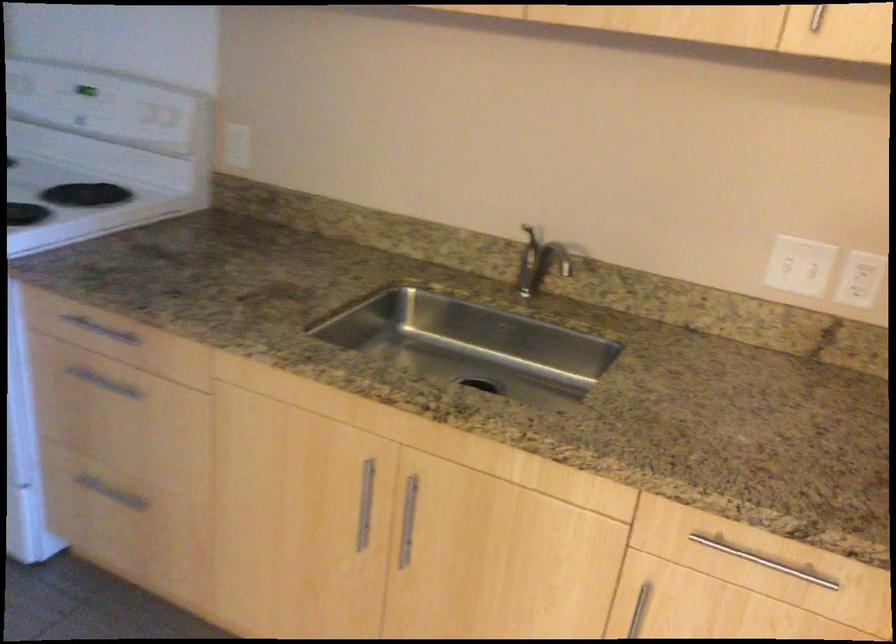
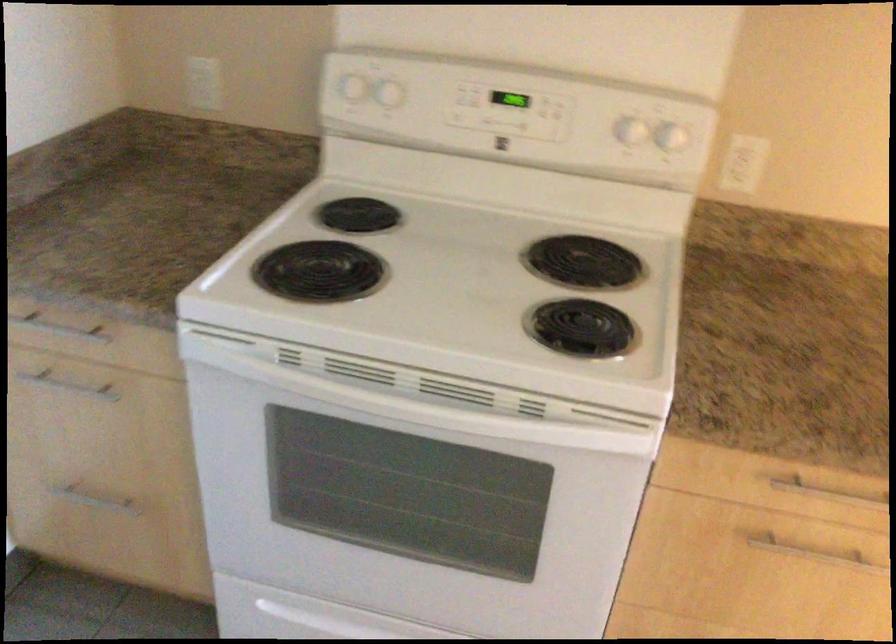
In a continuous first-person perspective shot, in which direction is the camera moving?

The cameraman walked toward left, forward.